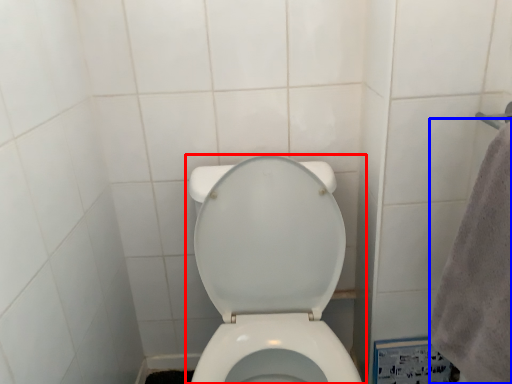
Question: Which object is further to the camera taking this photo, toilet (highlighted by a red box) or bath towel (highlighted by a blue box)?

Choices:
 (A) toilet
 (B) bath towel

Answer: (A)